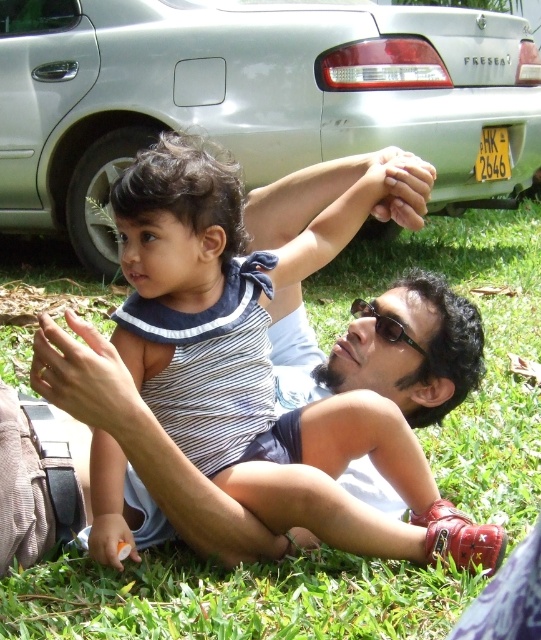
Question: Can you confirm if silver metallic car at upper center is thinner than green grass at center?

Choices:
 (A) yes
 (B) no

Answer: (B)

Question: Can you confirm if silver metallic car at upper center is thinner than green grass at center?

Choices:
 (A) yes
 (B) no

Answer: (B)

Question: Can you confirm if silver metallic car at upper center is thinner than green grass at center?

Choices:
 (A) yes
 (B) no

Answer: (B)